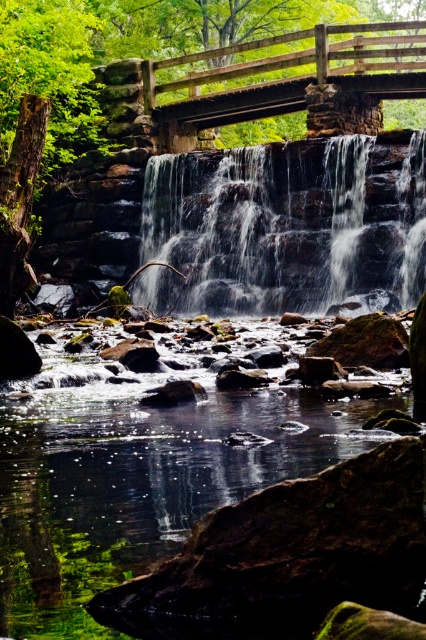
Question: Estimate the real-world distances between objects in this image. Which object is farther from the dark gray stone waterfall at center?

Choices:
 (A) wooden bridge at upper center
 (B) clear water at center

Answer: (B)

Question: Which of the following is the closest to the observer?

Choices:
 (A) (379, 84)
 (B) (278, 296)
 (C) (94, 497)

Answer: (C)

Question: Which point is farther from the camera taking this photo?

Choices:
 (A) (278, 154)
 (B) (68, 420)
 (C) (215, 97)

Answer: (C)

Question: Is dark gray stone waterfall at center bigger than wooden bridge at upper center?

Choices:
 (A) no
 (B) yes

Answer: (A)

Question: Is clear water at center thinner than dark gray stone waterfall at center?

Choices:
 (A) yes
 (B) no

Answer: (A)

Question: Does clear water at center have a larger size compared to dark gray stone waterfall at center?

Choices:
 (A) no
 (B) yes

Answer: (A)